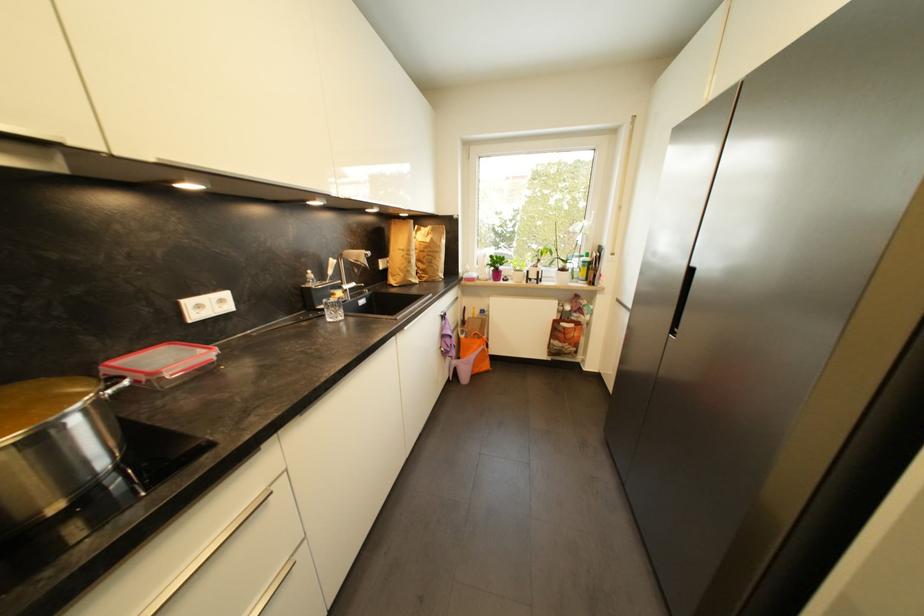
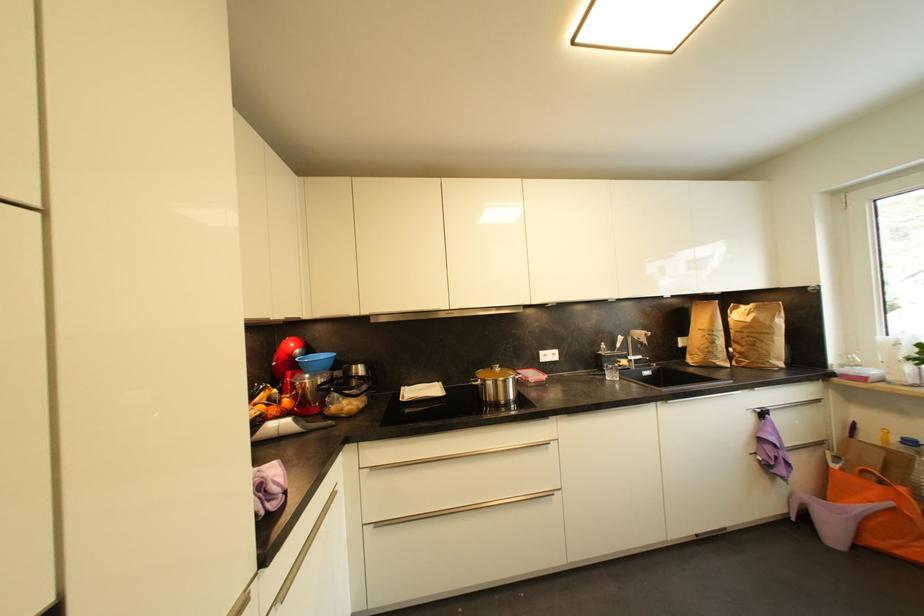
The point at (359, 286) is marked in the first image. Where is the corresponding point in the second image?

(645, 359)